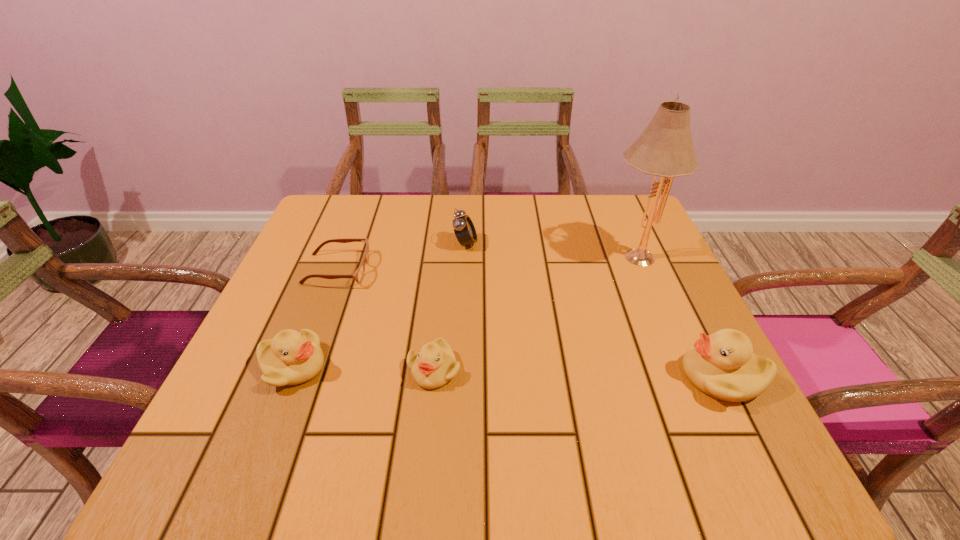
You are a GUI agent. You are given a task and a screenshot of the screen. Output one action in this format:
    pyautogui.click(x=<x>, y=<y>)
    Task: Click on the object that is the fourth nearest to the second duckling from right to left
    
    Given the screenshot: What is the action you would take?
    pyautogui.click(x=665, y=148)

Identify which object is the fourth nearest to the rightmost duckling. Please provide its 2D coordinates. Your answer should be formatted as a tuple, i.e. [(x, y)], where the tuple contains the x and y coordinates of a point satisfying the conditions above.

[(358, 275)]

Identify the location of the second closest duckling to the tallest object. This screenshot has height=540, width=960. (432, 367).

Identify which duckling is the third nearest to the shortest object. Please provide its 2D coordinates. Your answer should be formatted as a tuple, i.e. [(x, y)], where the tuple contains the x and y coordinates of a point satisfying the conditions above.

[(722, 365)]

At what (x,y) coordinates should I click in order to perform the action: click on free spot that satisfies the following two spatial constraints: 1. on the face of the lampshade; 2. on the right side of the alarm clock. Please return your answer as a coordinate pair (x, y). This screenshot has width=960, height=540. Looking at the image, I should click on (465, 254).